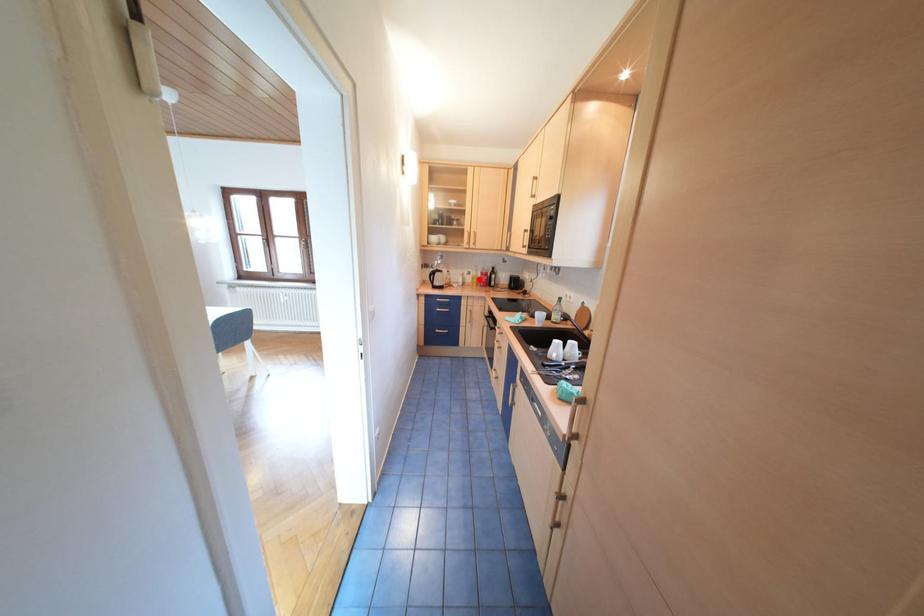
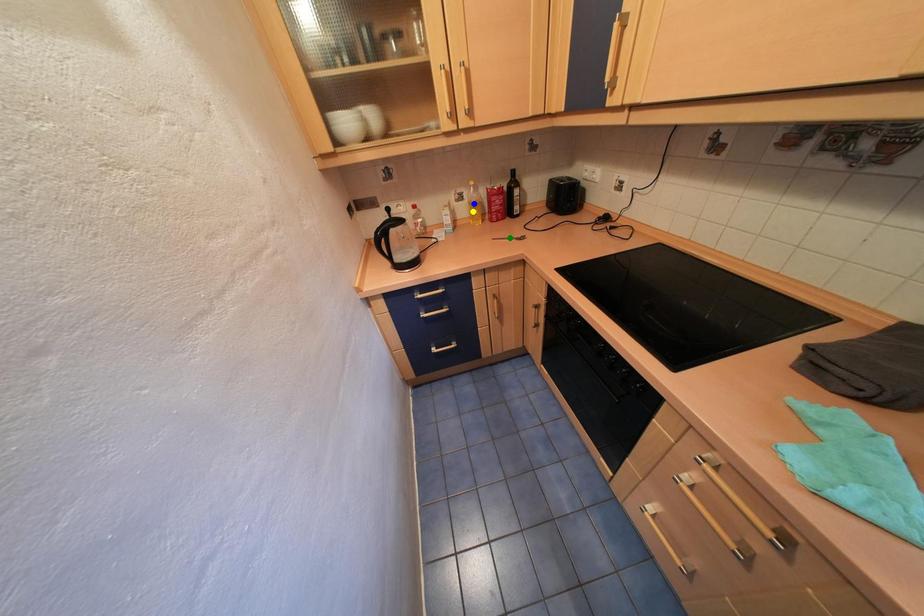
Question: I am providing you with two images of the same scene from different viewpoints. A red point is marked on the first image. You are given multiple points on the second image. In image 2, which mark is for the same physical point as the one in image 1?

Choices:
 (A) green point
 (B) blue point
 (C) yellow point

Answer: (C)